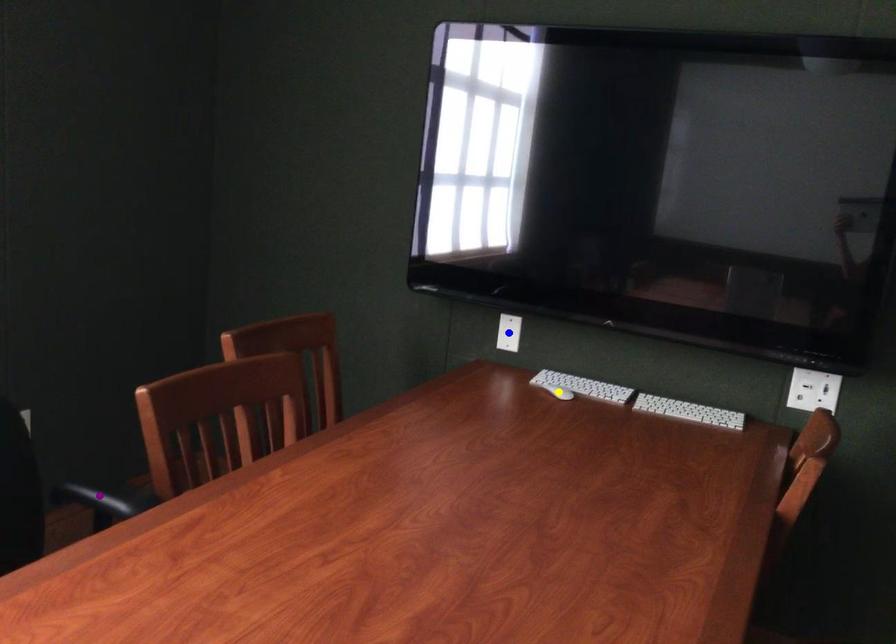
Order these from nearest to farthest:
purple point
blue point
yellow point

purple point, yellow point, blue point